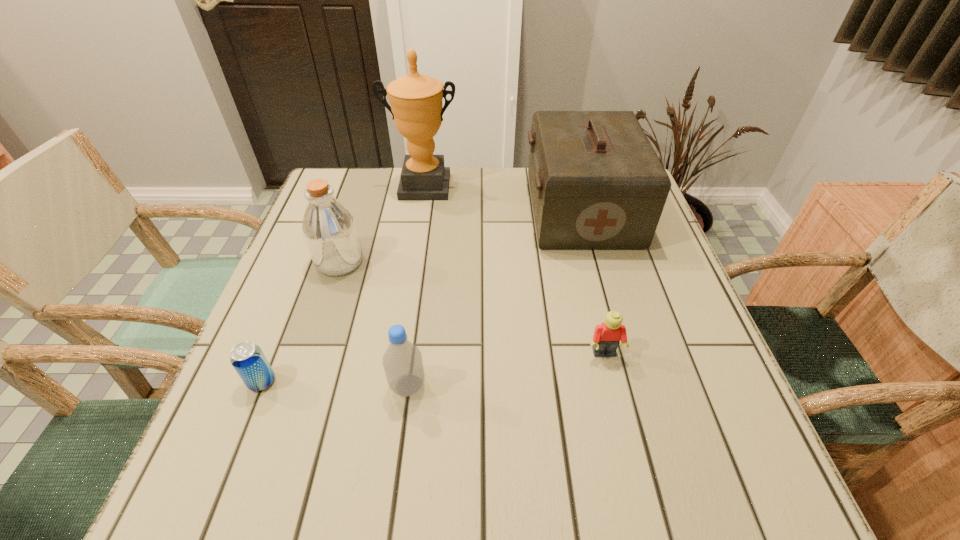
You are a GUI agent. You are given a task and a screenshot of the screen. Output one action in this format:
    pyautogui.click(x=<x>, y=<y>)
    Task: Click on the vacant space in between the tallest object and the right bottle
    The image size is (960, 540).
    Given the screenshot: What is the action you would take?
    pyautogui.click(x=416, y=286)

Locate an element on the screen. The width and height of the screenshot is (960, 540). free spot between the first-aid kit and the left bottle is located at coordinates (461, 236).

You are a GUI agent. You are given a task and a screenshot of the screen. Output one action in this format:
    pyautogui.click(x=<x>, y=<y>)
    Task: Click on the vacant region between the taller bottle and the Lego
    
    Given the screenshot: What is the action you would take?
    (x=472, y=308)

The height and width of the screenshot is (540, 960). Identify the location of free space between the Lego and the award. (514, 270).

Locate which object is the fourth closest to the beer can. Please provide its 2D coordinates. Your answer should be formatted as a tuple, i.e. [(x, y)], where the tuple contains the x and y coordinates of a point satisfying the conditions above.

[(607, 336)]

Select which object appears as the fifth closest to the taller bottle. Please provide its 2D coordinates. Your answer should be formatted as a tuple, i.e. [(x, y)], where the tuple contains the x and y coordinates of a point satisfying the conditions above.

[(607, 336)]

Where is `free spot that satisfies the following two spatial constraints: 1. on the front side of the beer can; 2. on the left side of the right bottle`? This screenshot has height=540, width=960. free spot that satisfies the following two spatial constraints: 1. on the front side of the beer can; 2. on the left side of the right bottle is located at coordinates (260, 386).

You are a GUI agent. You are given a task and a screenshot of the screen. Output one action in this format:
    pyautogui.click(x=<x>, y=<y>)
    Task: Click on the vacant position in the image that satisfies the following two spatial constraints: 1. on the front side of the left bottle; 2. on the right side of the nearer bottle
    This screenshot has width=960, height=540.
    Given the screenshot: What is the action you would take?
    pyautogui.click(x=299, y=386)